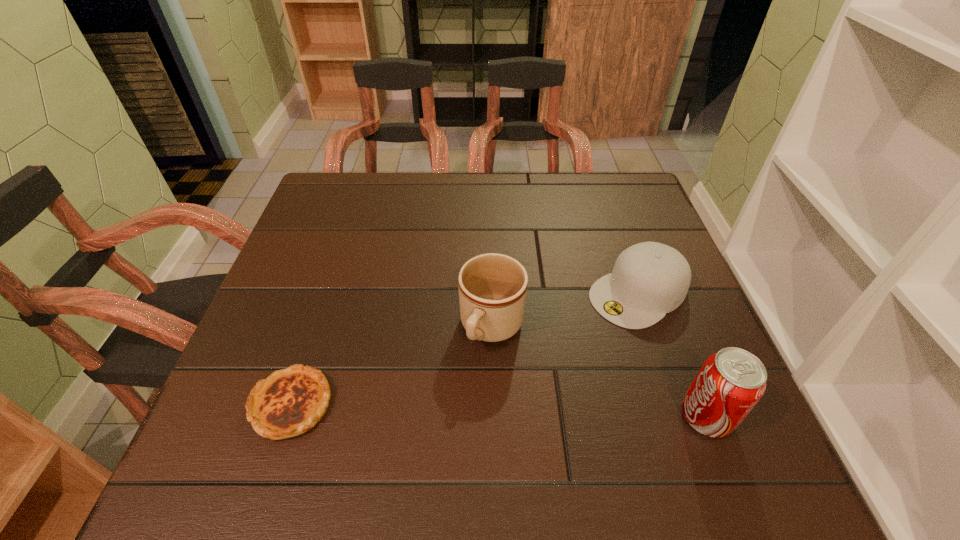
You are a GUI agent. You are given a task and a screenshot of the screen. Output one action in this format:
    pyautogui.click(x=<x>, y=<y>)
    Task: Click on the vacant space that satisfies the following two spatial constraints: 1. on the back side of the third tallest object; 2. on the right side of the quiche
    
    Given the screenshot: What is the action you would take?
    pyautogui.click(x=328, y=293)